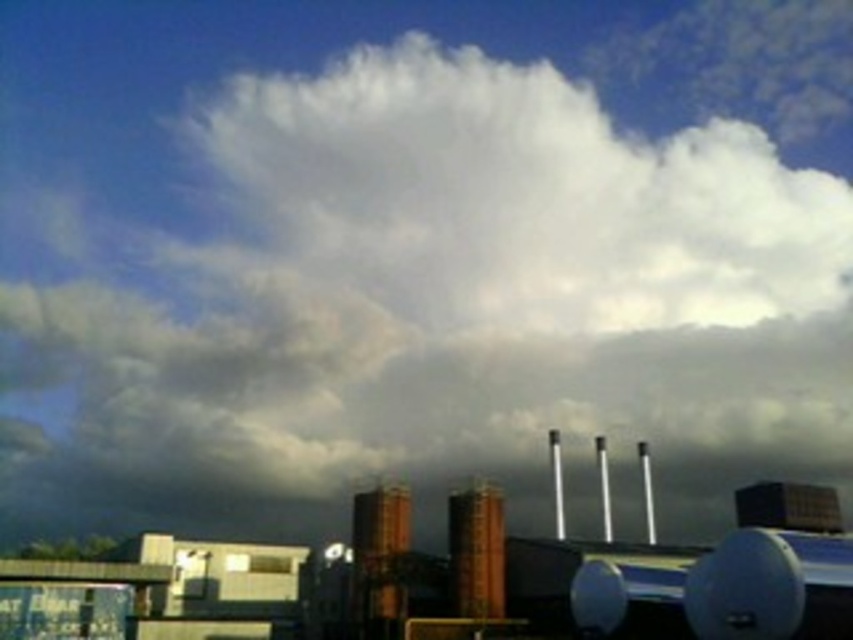
Can you confirm if metallic gray factory at center is wider than orange brick chimney at center?

Correct, the width of metallic gray factory at center exceeds that of orange brick chimney at center.

Is metallic gray factory at center shorter than orange brick chimney at center?

No.

Image resolution: width=853 pixels, height=640 pixels. Describe the element at coordinates (704, 573) in the screenshot. I see `metallic gray factory at center` at that location.

Find the location of `metallic gray factory at center`. metallic gray factory at center is located at coordinates (704, 573).

Is brown brick chimney at center positioned at the back of orange brick chimney at center?

No, brown brick chimney at center is closer to the viewer.

Is point (393, 524) farther from camera compared to point (466, 561)?

Yes, point (393, 524) is behind point (466, 561).

Image resolution: width=853 pixels, height=640 pixels. Find the location of `brown brick chimney at center`. brown brick chimney at center is located at coordinates (378, 561).

Between metallic gray factory at center and brown brick chimney at center, which one is positioned lower?

brown brick chimney at center is lower down.

Between point (817, 570) and point (407, 525), which one is positioned in front?

Positioned in front is point (817, 570).

Locate an element on the screen. metallic gray factory at center is located at coordinates tap(704, 573).